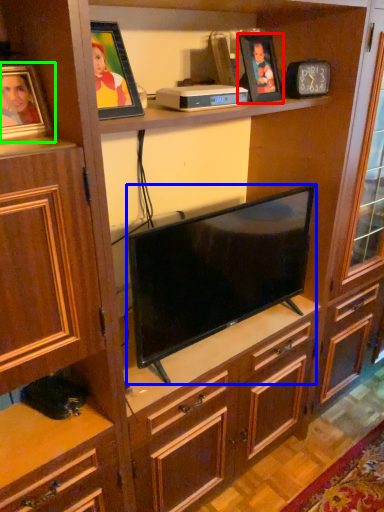
Question: Which object is positioned farthest from picture frame (highlighted by a red box)? Select from television (highlighted by a blue box) and picture frame (highlighted by a green box).

Choices:
 (A) television
 (B) picture frame

Answer: (B)